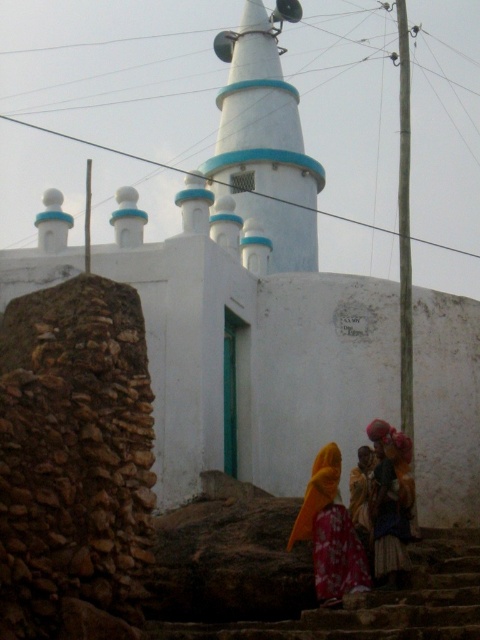
You are standing at the point marked as point (x=377, y=604). The building with the conical minaret is in front of you. Are you currently on the stone wall or on the stone stairs?

You are on the stone stairs at lower center because the point (x=377, y=604) is on the stone stairs at lower center.

Consider the image. You are a tourist standing in front of the white building with the white painted tower at center and orange fabric headscarf at lower center. You want to take a photo that includes both objects. Which object should be placed closer to the camera to ensure both are in focus?

The white painted tower at center is bigger than orange fabric headscarf at lower center. To ensure both are in focus, place the orange fabric headscarf at lower center closer to the camera since it is smaller and the tower is larger, allowing for a greater depth of field when focusing on the closer object.